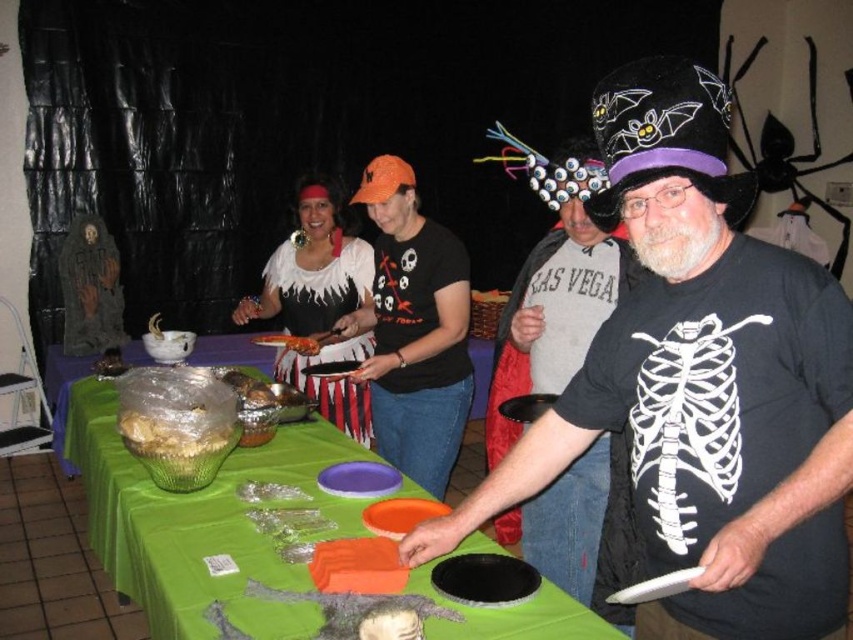
Is the position of matte black skeleton shirt at center less distant than that of black matte t-shirt at center?

Yes, matte black skeleton shirt at center is in front of black matte t-shirt at center.

From the picture: Is matte black skeleton shirt at center taller than black matte t-shirt at center?

Yes, matte black skeleton shirt at center is taller than black matte t-shirt at center.

The height and width of the screenshot is (640, 853). I want to click on matte black skeleton shirt at center, so click(x=555, y=310).

Locate an element on the screen. This screenshot has width=853, height=640. matte black skeleton shirt at center is located at coordinates (555, 310).

What do you see at coordinates (555, 310) in the screenshot? I see `matte black skeleton shirt at center` at bounding box center [555, 310].

This screenshot has height=640, width=853. What are the coordinates of `matte black skeleton shirt at center` in the screenshot? It's located at (555, 310).

Between point (585, 362) and point (407, 173), which one is positioned behind?

The point (407, 173) is more distant.

Between black matte skeleton shirt at center and black matte t-shirt at center, which one is positioned lower?

black matte skeleton shirt at center is below.

Does point (843, 406) come in front of point (378, 392)?

Yes, it is in front of point (378, 392).

Find the location of `black matte skeleton shirt at center`. black matte skeleton shirt at center is located at coordinates (701, 381).